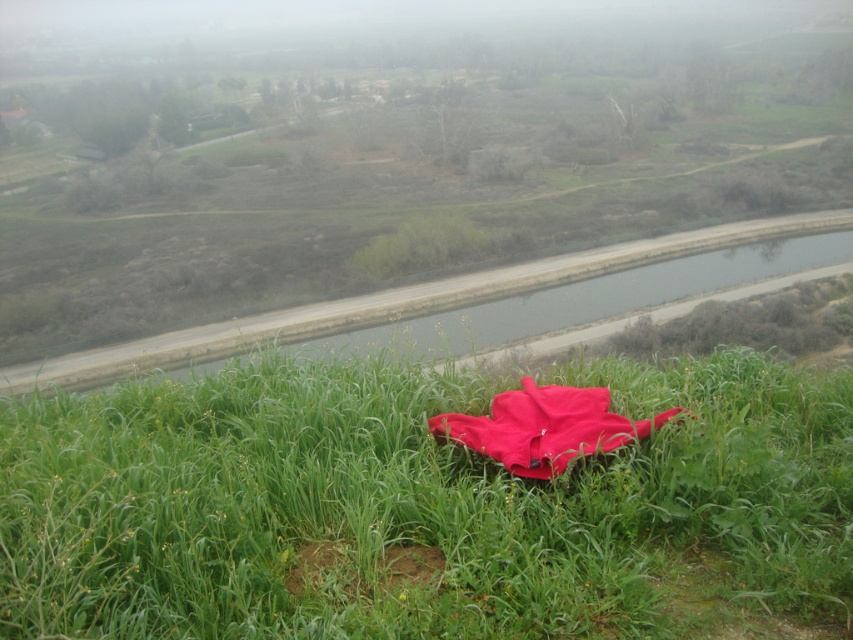
You are a gardener planning to plant flowers along the smooth concrete river at center and the brown dirt patch at lower center. Which area would you choose for better soil quality?

The brown dirt patch at lower center has better soil quality for planting flowers since it is positioned under the smooth concrete river at center, indicating it is the actual ground where plants can grow.

You are a hiker who wants to place a small backpack on the ground. You see the matte red fabric at center and the brown dirt patch at lower center. Which location is closer to your right side if you are facing the scene?

The matte red fabric at center is to the right of brown dirt patch at lower center, so if you are facing the scene, the matte red fabric at center is closer to your right side.

You are a photographer trying to capture the matte red fabric at center and the smooth concrete river at center in the same frame. Based on their sizes in the image, which object would appear smaller in the photo?

The matte red fabric at center appears smaller in the photo because it is shorter than the smooth concrete river at center.